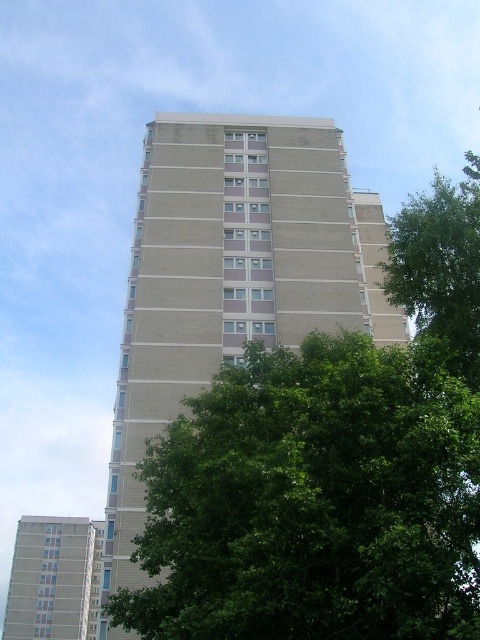
Between beige brick building at center and green leafy tree at right, which one is positioned lower?

beige brick building at center is below.

Locate an element on the screen. The image size is (480, 640). beige brick building at center is located at coordinates (232, 275).

The image size is (480, 640). Identify the location of beige brick building at center. (232, 275).

Can you confirm if green leafy tree at right is positioned above beige concrete building at lower left?

Yes, green leafy tree at right is above beige concrete building at lower left.

Image resolution: width=480 pixels, height=640 pixels. Find the location of `green leafy tree at right`. green leafy tree at right is located at coordinates (441, 268).

Find the location of a particular element. This screenshot has height=640, width=480. green leafy tree at right is located at coordinates (441, 268).

Which is above, beige brick building at center or beige concrete building at lower left?

beige brick building at center

Which is more to the left, beige brick building at center or beige concrete building at lower left?

beige concrete building at lower left is more to the left.

Is point (144, 180) positioned in front of point (82, 605)?

Yes, point (144, 180) is closer to viewer.

The image size is (480, 640). I want to click on beige brick building at center, so click(x=232, y=275).